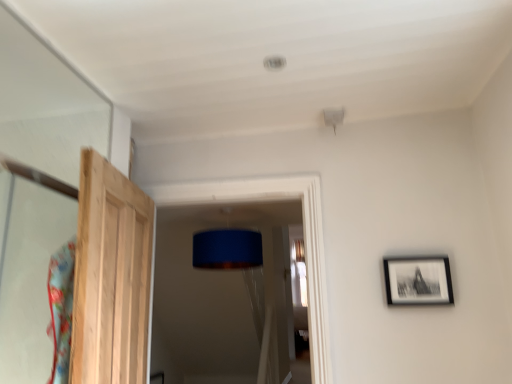
This screenshot has height=384, width=512. Describe the element at coordinates (418, 281) in the screenshot. I see `black matte picture frame at right` at that location.

Identify the location of black matte picture frame at right. This screenshot has width=512, height=384. (418, 281).

What is the approximate width of black matte picture frame at right?

black matte picture frame at right is 1.45 inches wide.

In order to face natural wood door at left, should I rotate leftwards or rightwards?

A 17.538 degree turn to the left will do.

Where is `natural wood door at left`? natural wood door at left is located at coordinates (111, 277).

The height and width of the screenshot is (384, 512). What do you see at coordinates (111, 277) in the screenshot? I see `natural wood door at left` at bounding box center [111, 277].

Locate an element on the screen. black matte picture frame at right is located at coordinates (418, 281).

From the picture: Based on their positions, is natural wood door at left located to the left or right of black matte picture frame at right?

In the image, natural wood door at left appears on the left side of black matte picture frame at right.

In the image, is natural wood door at left positioned in front of or behind black matte picture frame at right?

natural wood door at left is in front of black matte picture frame at right.

Considering the positions of points (131, 366) and (448, 292), is point (131, 366) farther from camera compared to point (448, 292)?

No, it is not.

From the image's perspective, which is above, natural wood door at left or black matte picture frame at right?

natural wood door at left is shown above in the image.

From a real-world perspective, is natural wood door at left above or below black matte picture frame at right?

Clearly, from a real-world perspective, natural wood door at left is above black matte picture frame at right.

Based on the photo, considering the sizes of natural wood door at left and black matte picture frame at right in the image, is natural wood door at left wider or thinner than black matte picture frame at right?

Considering their sizes, natural wood door at left looks broader than black matte picture frame at right.

Can you confirm if natural wood door at left is taller than black matte picture frame at right?

Correct, natural wood door at left is much taller as black matte picture frame at right.

Considering the relative sizes of natural wood door at left and black matte picture frame at right in the image provided, is natural wood door at left bigger than black matte picture frame at right?

Correct, natural wood door at left is larger in size than black matte picture frame at right.

Which is correct: natural wood door at left is inside black matte picture frame at right, or outside of it?

natural wood door at left lies outside black matte picture frame at right.

Is natural wood door at left next to black matte picture frame at right?

No, natural wood door at left is not in contact with black matte picture frame at right.

Is natural wood door at left positioned with its back to black matte picture frame at right?

natural wood door at left does not have its back to black matte picture frame at right.

The width and height of the screenshot is (512, 384). What are the coordinates of `door on the left of black matte picture frame at right` in the screenshot? It's located at (111, 277).

Would you say black matte picture frame at right is to the left or to the right of natural wood door at left in the picture?

black matte picture frame at right is positioned on natural wood door at left's right side.

In the scene shown: Between black matte picture frame at right and natural wood door at left, which one is positioned in front?

natural wood door at left is more forward.

Which is in front, point (444, 282) or point (86, 150)?

Positioned in front is point (86, 150).

From the image's perspective, which one is positioned higher, black matte picture frame at right or natural wood door at left?

natural wood door at left appears higher in the image.

From a real-world perspective, between black matte picture frame at right and natural wood door at left, who is vertically lower?

black matte picture frame at right is physically lower.

Can you confirm if black matte picture frame at right is thinner than natural wood door at left?

Correct, the width of black matte picture frame at right is less than that of natural wood door at left.

Considering the relative sizes of black matte picture frame at right and natural wood door at left in the image provided, is black matte picture frame at right taller than natural wood door at left?

No.

Is black matte picture frame at right bigger or smaller than natural wood door at left?

Result: In the image, black matte picture frame at right appears to be smaller than natural wood door at left.

Can natural wood door at left be found inside black matte picture frame at right?

No, natural wood door at left is not inside black matte picture frame at right.

Is black matte picture frame at right touching natural wood door at left?

They are not placed beside each other.

Could you tell me if black matte picture frame at right is facing natural wood door at left?

No.

Can you tell me how much black matte picture frame at right and natural wood door at left differ in facing direction?

101 degrees.

From the picture: How distant is black matte picture frame at right from natural wood door at left?

3.86 feet.

Identify the location of picture frame located underneath the natural wood door at left (from a real-world perspective). (418, 281).

The image size is (512, 384). What are the coordinates of `door that is above the black matte picture frame at right (from a real-world perspective)` in the screenshot? It's located at (111, 277).

You are a GUI agent. You are given a task and a screenshot of the screen. Output one action in this format:
    pyautogui.click(x=<x>, y=<y>)
    Task: Click on the door that appears in front of the black matte picture frame at right
    The image size is (512, 384).
    Given the screenshot: What is the action you would take?
    pyautogui.click(x=111, y=277)